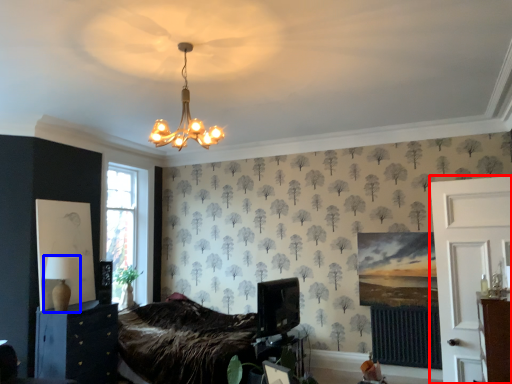
Question: Which object is further to the camera taking this photo, side (highlighted by a red box) or table lamp (highlighted by a blue box)?

Choices:
 (A) side
 (B) table lamp

Answer: (B)